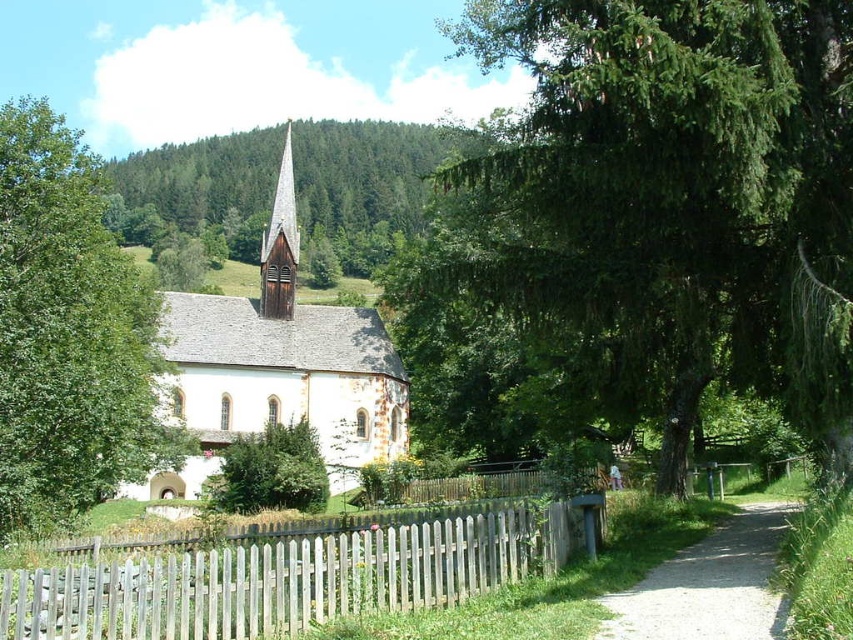
Question: Estimate the real-world distances between objects in this image. Which object is closer to the green textured tree at center?

Choices:
 (A) white wooden picket fence at lower center
 (B) green leafy tree at left

Answer: (B)

Question: Which point is closer to the camera taking this photo?

Choices:
 (A) (259, 305)
 (B) (384, 561)
 (C) (61, 413)
 (D) (735, 577)

Answer: (B)

Question: Does green textured tree at center appear on the left side of wooden spire at center?

Choices:
 (A) yes
 (B) no

Answer: (B)

Question: Can you confirm if green leafy tree at left is positioned to the left of gravel path at lower right?

Choices:
 (A) no
 (B) yes

Answer: (B)

Question: Which of the following is the farthest from the observer?

Choices:
 (A) (288, 140)
 (B) (694, 579)
 (C) (813, 228)

Answer: (A)

Question: Observing the image, what is the correct spatial positioning of green leafy tree at left in reference to wooden spire at center?

Choices:
 (A) left
 (B) right

Answer: (A)